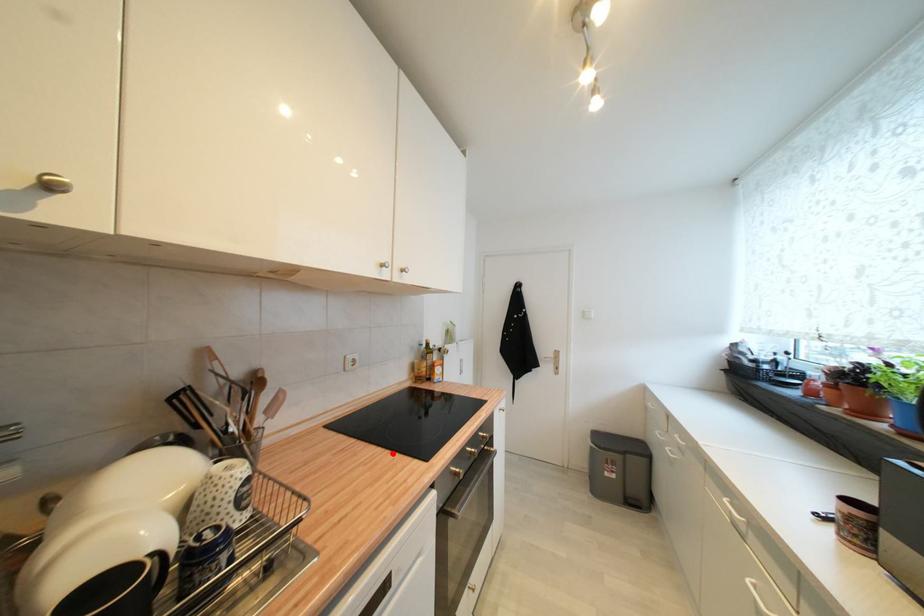
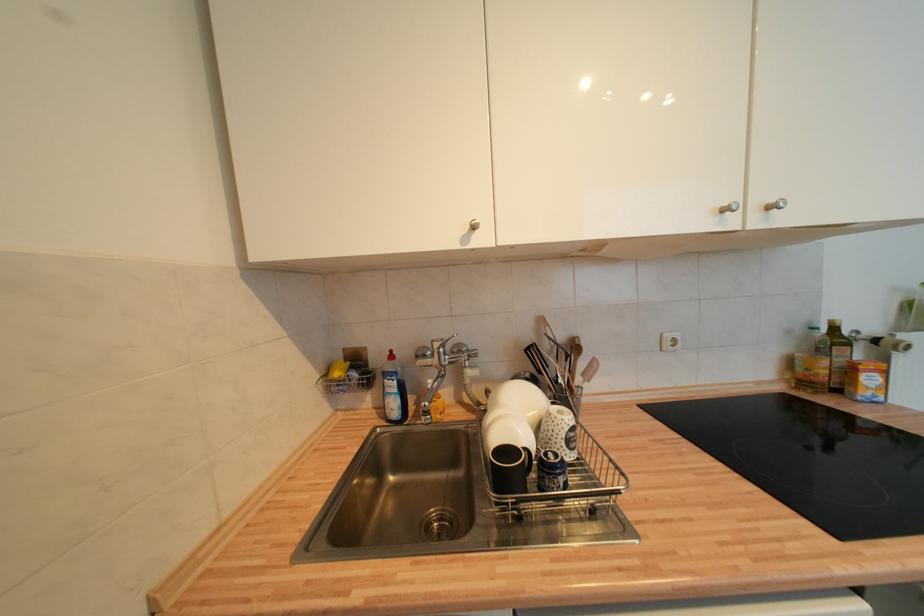
Locate, in the second image, the point that corresponds to the highlighted location in the first image.

(742, 477)